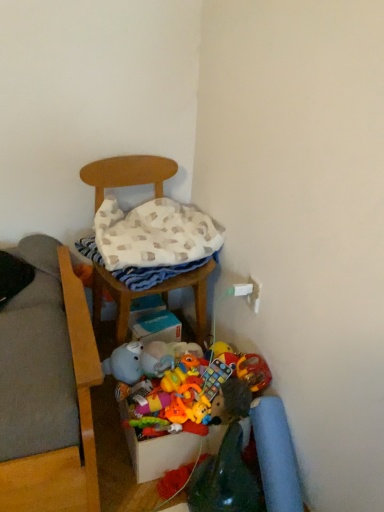
Find the location of a particular element. The height and width of the screenshot is (512, 384). soft plush toy at center is located at coordinates (151, 402).

Could wooden chair at center be considered to be inside multicolored fabric storage box at lower center?

No, multicolored fabric storage box at lower center does not contain wooden chair at center.

Can you confirm if multicolored fabric storage box at lower center is thinner than wooden chair at center?

Indeed, multicolored fabric storage box at lower center has a lesser width compared to wooden chair at center.

Which is behind, point (171, 435) or point (116, 162)?

The point (116, 162) is farther.

Where is `storage box beneath the soft plush toy at center (from a real-world perspective)`? storage box beneath the soft plush toy at center (from a real-world perspective) is located at coordinates (160, 453).

Are multicolored fabric storage box at lower center and soft plush toy at center beside each other?

multicolored fabric storage box at lower center and soft plush toy at center are not in contact.

Based on the photo, from a real-world perspective, is multicolored fabric storage box at lower center over soft plush toy at center?

Incorrect, from a real-world perspective, multicolored fabric storage box at lower center is lower than soft plush toy at center.

Considering the relative positions of multicolored fabric storage box at lower center and soft plush toy at center in the image provided, is multicolored fabric storage box at lower center behind soft plush toy at center?

No, it is in front of soft plush toy at center.

At what (x,y) coordinates should I click in order to perform the action: click on toy below the wooden chair at center (from a real-world perspective). Please return your answer as a coordinate pair (x, y). This screenshot has width=384, height=512. Looking at the image, I should click on (151, 402).

From a real-world perspective, which is physically above, soft plush toy at center or wooden chair at center?

From a 3D spatial view, wooden chair at center is above.

Based on their positions, is soft plush toy at center located to the left or right of wooden chair at center?

In the image, soft plush toy at center appears on the right side of wooden chair at center.

Does point (155, 399) appear closer or farther from the camera than point (108, 176)?

Clearly, point (155, 399) is closer to the camera than point (108, 176).

From the image's perspective, which is above, wooden chair at center or multicolored fabric storage box at lower center?

wooden chair at center, from the image's perspective.

Is wooden chair at center further to the viewer compared to multicolored fabric storage box at lower center?

No, the depth of wooden chair at center is less than that of multicolored fabric storage box at lower center.

From a real-world perspective, is wooden chair at center physically above multicolored fabric storage box at lower center?

Yes, from a real-world perspective, wooden chair at center is on top of multicolored fabric storage box at lower center.

Is wooden chair at center situated inside multicolored fabric storage box at lower center or outside?

wooden chair at center cannot be found inside multicolored fabric storage box at lower center.

Considering the sizes of objects wooden chair at center and soft plush toy at center in the image provided, who is taller, wooden chair at center or soft plush toy at center?

wooden chair at center.

How different are the orientations of wooden chair at center and soft plush toy at center in degrees?

The facing directions of wooden chair at center and soft plush toy at center are 9.79 degrees apart.

Can you confirm if wooden chair at center is bigger than soft plush toy at center?

Yes.

From the image's perspective, is wooden chair at center located above soft plush toy at center?

Yes.

Considering the sizes of soft plush toy at center and multicolored fabric storage box at lower center in the image, is soft plush toy at center bigger or smaller than multicolored fabric storage box at lower center?

Considering their sizes, soft plush toy at center takes up less space than multicolored fabric storage box at lower center.

In the image, is soft plush toy at center on the left side or the right side of multicolored fabric storage box at lower center?

soft plush toy at center is to the left of multicolored fabric storage box at lower center.

Can you confirm if soft plush toy at center is wider than multicolored fabric storage box at lower center?

No, soft plush toy at center is not wider than multicolored fabric storage box at lower center.

Is soft plush toy at center looking in the opposite direction of multicolored fabric storage box at lower center?

That's not correct — soft plush toy at center is not looking away from multicolored fabric storage box at lower center.

What are the coordinates of `storage box on the right of the wooden chair at center` in the screenshot? It's located at (160, 453).

Locate an element on the screen. The height and width of the screenshot is (512, 384). toy on the left of multicolored fabric storage box at lower center is located at coordinates (151, 402).

Looking at the image, which one is located closer to multicolored fabric storage box at lower center, soft plush toy at center or wooden chair at center?

Based on the image, soft plush toy at center appears to be nearer to multicolored fabric storage box at lower center.

Looking at the image, which one is located closer to wooden chair at center, multicolored fabric storage box at lower center or soft plush toy at center?

soft plush toy at center lies closer to wooden chair at center than the other object.

Considering their positions, is multicolored fabric storage box at lower center positioned closer to soft plush toy at center than wooden chair at center?

Based on the image, multicolored fabric storage box at lower center appears to be nearer to soft plush toy at center.

Looking at the image, which one is located further to soft plush toy at center, wooden chair at center or multicolored fabric storage box at lower center?

Among the two, wooden chair at center is located further to soft plush toy at center.

Estimate the real-world distances between objects in this image. Which object is further from multicolored fabric storage box at lower center, wooden chair at center or soft plush toy at center?

Among the two, wooden chair at center is located further to multicolored fabric storage box at lower center.

From the image, which object appears to be farther from wooden chair at center, soft plush toy at center or multicolored fabric storage box at lower center?

multicolored fabric storage box at lower center is further to wooden chair at center.

At what (x,y) coordinates should I click in order to perform the action: click on toy between wooden chair at center and multicolored fabric storage box at lower center in the up-down direction. Please return your answer as a coordinate pair (x, y). The width and height of the screenshot is (384, 512). Looking at the image, I should click on (151, 402).